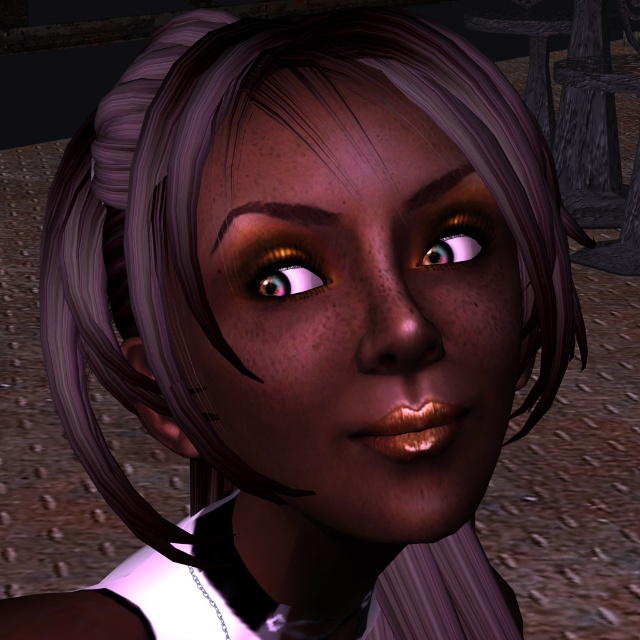
Does shiny gold eye at center appear on the left side of shiny brown eyebrow at upper center?

Incorrect, shiny gold eye at center is not on the left side of shiny brown eyebrow at upper center.

In the scene shown: Who is more forward, (305,269) or (308,209)?

Positioned in front is point (308,209).

Is point (273, 282) closer to camera compared to point (236, 205)?

No.

Find the location of `shiny gold eye at center`. shiny gold eye at center is located at coordinates (282, 273).

Between matte skin face at center and shiny brown eyebrow at upper center, which one is positioned lower?

matte skin face at center is below.

Measure the distance between matte skin face at center and camera.

A distance of 12.66 inches exists between matte skin face at center and camera.

Identify the location of matte skin face at center. The width and height of the screenshot is (640, 640). (356, 317).

Between shiny gold eye at center and brown matte eyebrow at upper center, which one appears on the left side from the viewer's perspective?

shiny gold eye at center is more to the left.

Which is in front, point (291, 291) or point (440, 193)?

Positioned in front is point (291, 291).

Which is in front, point (300, 275) or point (408, 204)?

Point (408, 204) is in front.

Where is `shiny gold eye at center`? The width and height of the screenshot is (640, 640). shiny gold eye at center is located at coordinates (282, 273).